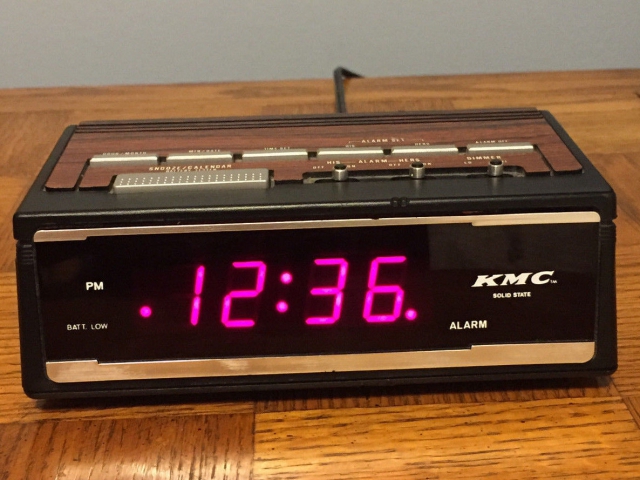
The image size is (640, 480). In order to click on clock in this screenshot , I will do `click(512, 260)`.